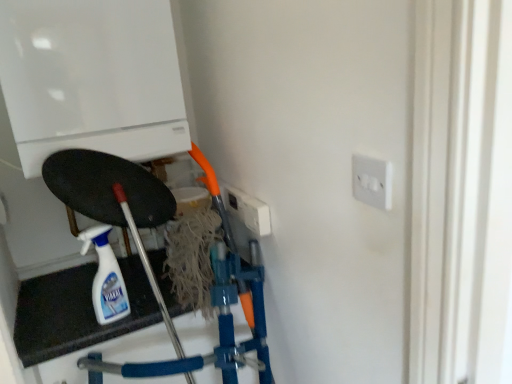
Measure the distance between point (104,285) and camera.

Point (104,285) is 1.13 meters from camera.

Find the location of a particular element. The image size is (512, 384). white glossy spray bottle at lower left is located at coordinates (106, 277).

From the picture: Which object is further away from the camera taking this photo, white glossy boiler at upper left or white plastic socket at upper right?

white glossy boiler at upper left is more distant.

Considering the sizes of white glossy boiler at upper left and white plastic socket at upper right in the image, is white glossy boiler at upper left taller or shorter than white plastic socket at upper right?

Clearly, white glossy boiler at upper left is taller compared to white plastic socket at upper right.

Can you tell me how much white glossy boiler at upper left and white plastic socket at upper right differ in facing direction?

The facing directions of white glossy boiler at upper left and white plastic socket at upper right are 90 degrees apart.

Find the location of a particular element. This screenshot has width=512, height=384. socket in front of the white glossy spray bottle at lower left is located at coordinates (372, 181).

Which is nearer, (387, 195) or (97, 309)?

Positioned in front is point (387, 195).

Can you confirm if white plastic socket at upper right is positioned to the right of white glossy spray bottle at lower left?

Correct, you'll find white plastic socket at upper right to the right of white glossy spray bottle at lower left.

Is white plastic socket at upper right not close to white glossy spray bottle at lower left?

white plastic socket at upper right is actually quite close to white glossy spray bottle at lower left.

How far apart are white glossy spray bottle at lower left and white glossy boiler at upper left?

15.88 inches.

Does white glossy spray bottle at lower left appear on the right side of white glossy boiler at upper left?

Indeed, white glossy spray bottle at lower left is positioned on the right side of white glossy boiler at upper left.

Locate an element on the screen. The width and height of the screenshot is (512, 384). bottle below the white glossy boiler at upper left (from the image's perspective) is located at coordinates (106, 277).

Is white glossy spray bottle at lower left in contact with white glossy boiler at upper left?

They are not placed beside each other.

Between white glossy spray bottle at lower left and white plastic socket at upper right, which one has larger size?

With larger size is white glossy spray bottle at lower left.

Is white glossy spray bottle at lower left not close to white plastic socket at upper right?

No, there isn't a large distance between white glossy spray bottle at lower left and white plastic socket at upper right.

Based on their positions, is white glossy spray bottle at lower left located to the left or right of white plastic socket at upper right?

white glossy spray bottle at lower left is to the left of white plastic socket at upper right.

Looking at this image, would you say white plastic socket at upper right is part of white glossy spray bottle at lower left's contents?

No, white plastic socket at upper right is located outside of white glossy spray bottle at lower left.

In the image, there is a white glossy boiler at upper left. What are the coordinates of `bottle below it (from the image's perspective)` in the screenshot? It's located at (106, 277).

From the image's perspective, between white glossy boiler at upper left and white glossy spray bottle at lower left, which one is located above?

white glossy boiler at upper left.

Is white glossy boiler at upper left to the left or to the right of white glossy spray bottle at lower left in the image?

Based on their positions, white glossy boiler at upper left is located to the left of white glossy spray bottle at lower left.

In terms of size, does white glossy boiler at upper left appear bigger or smaller than white glossy spray bottle at lower left?

Clearly, white glossy boiler at upper left is larger in size than white glossy spray bottle at lower left.

Considering the sizes of objects white plastic socket at upper right and white glossy boiler at upper left in the image provided, who is taller, white plastic socket at upper right or white glossy boiler at upper left?

white glossy boiler at upper left.

Based on the photo, considering the sizes of white plastic socket at upper right and white glossy boiler at upper left in the image, is white plastic socket at upper right bigger or smaller than white glossy boiler at upper left?

In the image, white plastic socket at upper right appears to be smaller than white glossy boiler at upper left.

Is white plastic socket at upper right oriented towards white glossy boiler at upper left?

No, white plastic socket at upper right is not facing towards white glossy boiler at upper left.

How many degrees apart are the facing directions of white plastic socket at upper right and white glossy boiler at upper left?

The facing directions of white plastic socket at upper right and white glossy boiler at upper left are 90 degrees apart.

In the image, there is a white glossy boiler at upper left. In order to click on socket below it (from the image's perspective) in this screenshot , I will do `click(372, 181)`.

Locate an element on the screen. The width and height of the screenshot is (512, 384). socket on the right of white glossy spray bottle at lower left is located at coordinates (372, 181).

From the image, which object appears to be nearer to white glossy spray bottle at lower left, white glossy boiler at upper left or white plastic socket at upper right?

The object closer to white glossy spray bottle at lower left is white glossy boiler at upper left.

Estimate the real-world distances between objects in this image. Which object is further from white glossy spray bottle at lower left, white plastic socket at upper right or white glossy boiler at upper left?

white plastic socket at upper right lies further to white glossy spray bottle at lower left than the other object.

From the image, which object appears to be farther from white glossy boiler at upper left, white plastic socket at upper right or white glossy spray bottle at lower left?

white plastic socket at upper right lies further to white glossy boiler at upper left than the other object.

Looking at the image, which one is located further to white plastic socket at upper right, white glossy spray bottle at lower left or white glossy boiler at upper left?

white glossy spray bottle at lower left is positioned further to the anchor white plastic socket at upper right.

Considering their positions, is white glossy boiler at upper left positioned closer to white plastic socket at upper right than white glossy spray bottle at lower left?

The object closer to white plastic socket at upper right is white glossy boiler at upper left.

Considering their positions, is white glossy spray bottle at lower left positioned closer to white glossy boiler at upper left than white plastic socket at upper right?

white glossy spray bottle at lower left is positioned closer to the anchor white glossy boiler at upper left.

Locate an element on the screen. This screenshot has height=384, width=512. bottle between white glossy boiler at upper left and white plastic socket at upper right in the horizontal direction is located at coordinates [x=106, y=277].